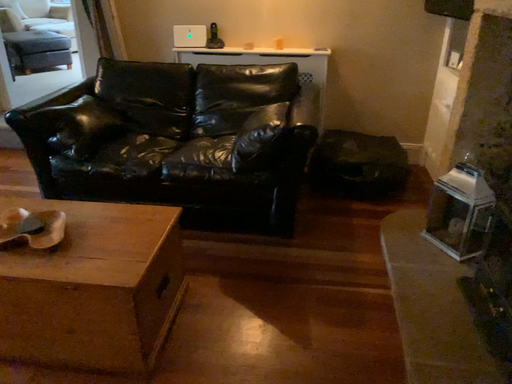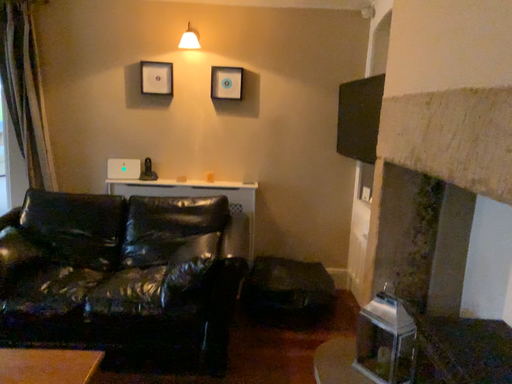
Question: Which way did the camera rotate in the video?

Choices:
 (A) rotated downward
 (B) rotated upward

Answer: (B)